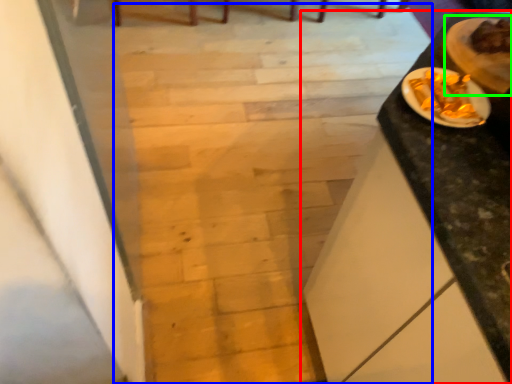
Question: Which object is the farthest from table (highlighted by a red box)? Choose among these: stairwell (highlighted by a blue box) or food (highlighted by a green box).

Choices:
 (A) stairwell
 (B) food

Answer: (A)